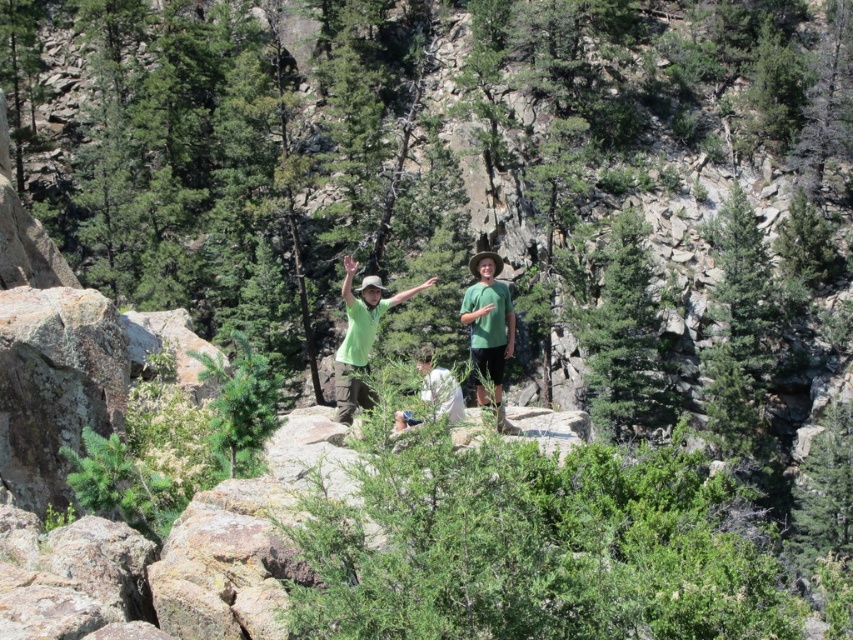
In the scene shown: Can you confirm if green matte shirt at center is positioned to the right of white cotton shirt at center?

In fact, green matte shirt at center is to the left of white cotton shirt at center.

This screenshot has width=853, height=640. I want to click on green matte shirt at center, so click(360, 337).

Locate an element on the screen. The image size is (853, 640). green matte shirt at center is located at coordinates (360, 337).